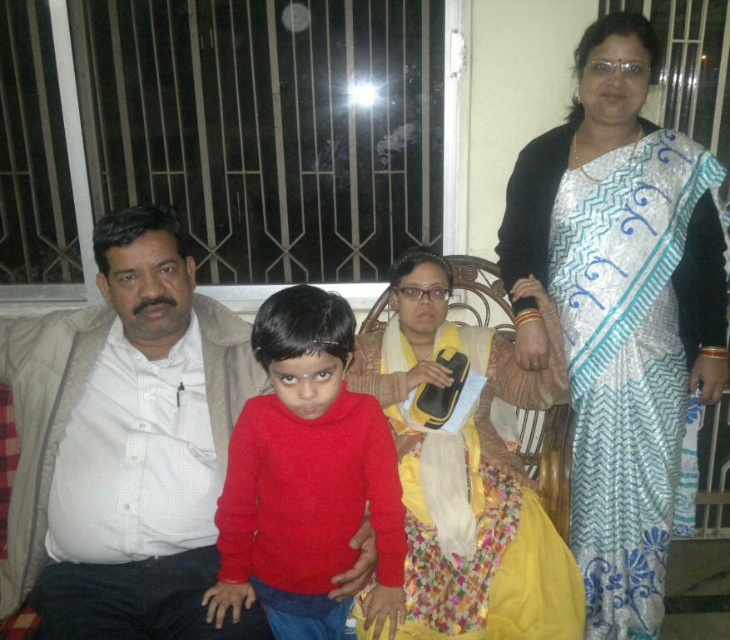
This screenshot has width=730, height=640. Describe the element at coordinates (623, 308) in the screenshot. I see `silver metallic saree at upper right` at that location.

Is point (566, 276) closer to viewer compared to point (412, 538)?

That is False.

The height and width of the screenshot is (640, 730). Identify the location of silver metallic saree at upper right. (623, 308).

This screenshot has width=730, height=640. Find the location of `silver metallic saree at upper right`. silver metallic saree at upper right is located at coordinates (623, 308).

Is point (219, 413) farther from viewer compared to point (347, 452)?

Yes, it is.

Which of these two, white checkered shirt at left or matte red sweater at center, stands taller?

With more height is white checkered shirt at left.

Locate an element on the screen. Image resolution: width=730 pixels, height=640 pixels. white checkered shirt at left is located at coordinates (123, 444).

Identify the location of white checkered shirt at left. The image size is (730, 640). (123, 444).

Between silver metallic saree at upper right and white checkered shirt at left, which one has more height?

silver metallic saree at upper right

Between point (602, 317) and point (115, 362), which one is positioned behind?

Point (602, 317)

Find the location of a particular element. silver metallic saree at upper right is located at coordinates [623, 308].